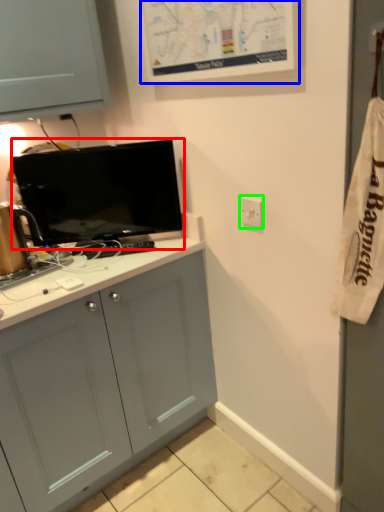
Question: Based on their relative distances, which object is farther from television (highlighted by a red box)? Choose from bulletin board (highlighted by a blue box) and electric outlet (highlighted by a green box).

Choices:
 (A) bulletin board
 (B) electric outlet

Answer: (B)